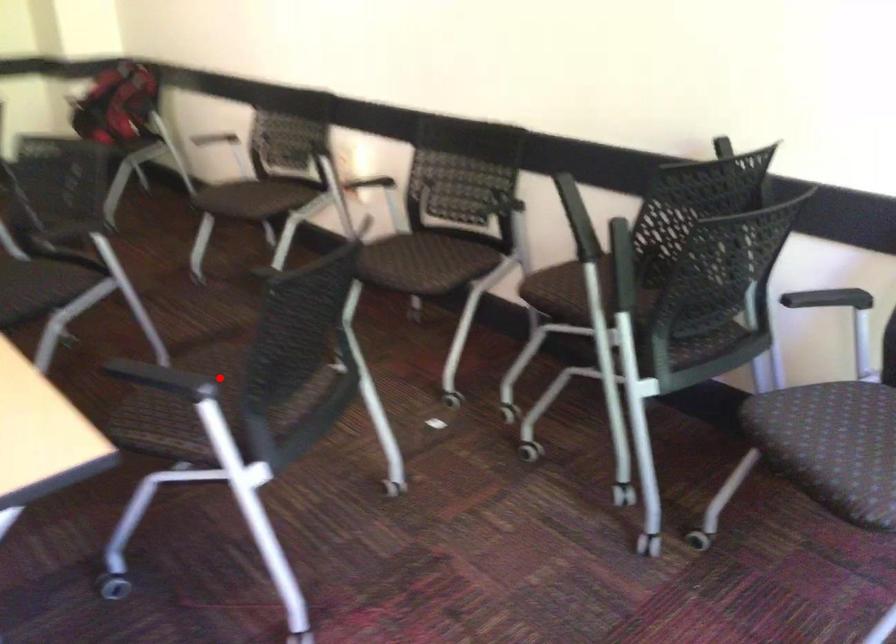
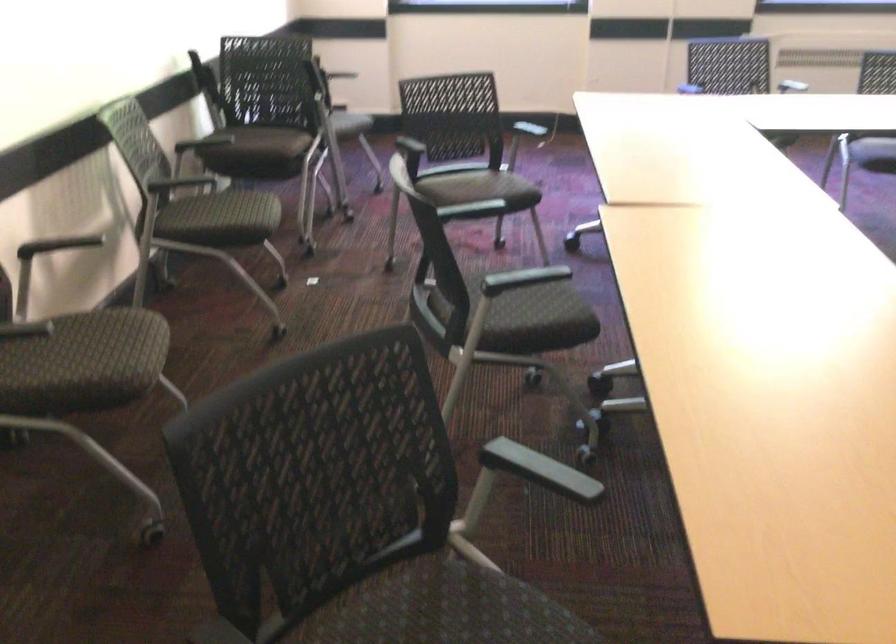
Question: I am providing you with two images of the same scene from different viewpoints. Image1 has a red point marked. In image2, the corresponding 3D location appears at what relative position? Reply with the corresponding letter.

Choices:
 (A) Closer
 (B) Farther

Answer: (B)